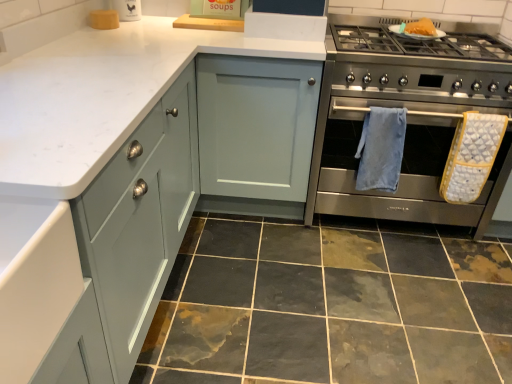
What do you see at coordinates (381, 149) in the screenshot?
I see `blue soft towel at center right, the 2th bath towel positioned from the right` at bounding box center [381, 149].

The height and width of the screenshot is (384, 512). What do you see at coordinates (471, 156) in the screenshot? I see `yellow textured oven mitt at right, positioned as the first bath towel in right-to-left order` at bounding box center [471, 156].

Identify the location of stainless steel oven at right. This screenshot has height=384, width=512. (402, 168).

Between marble tile at lower center and white marble countertop at upper left, which one has less height?

Standing shorter between the two is marble tile at lower center.

Based on their positions, is marble tile at lower center located to the left or right of white marble countertop at upper left?

Based on their positions, marble tile at lower center is located to the right of white marble countertop at upper left.

Is marble tile at lower center oriented towards white marble countertop at upper left?

No, marble tile at lower center does not turn towards white marble countertop at upper left.

From a real-world perspective, is marble tile at lower center under white marble countertop at upper left?

Correct, in the physical world, marble tile at lower center is lower than white marble countertop at upper left.

In the image, is white marble countertop at upper left positioned in front of or behind yellow textured oven mitt at right, positioned as the first bath towel in right-to-left order?

white marble countertop at upper left is positioned closer to the viewer than yellow textured oven mitt at right, positioned as the first bath towel in right-to-left order.

Does white marble countertop at upper left appear on the right side of yellow textured oven mitt at right, placed as the 2th bath towel when sorted from left to right?

No, white marble countertop at upper left is not to the right of yellow textured oven mitt at right, placed as the 2th bath towel when sorted from left to right.

Are white marble countertop at upper left and yellow textured oven mitt at right, placed as the 2th bath towel when sorted from left to right, far apart?

Yes, white marble countertop at upper left and yellow textured oven mitt at right, placed as the 2th bath towel when sorted from left to right, are located far from each other.

From a real-world perspective, which is physically below, white marble countertop at upper left or yellow textured oven mitt at right, placed as the 2th bath towel when sorted from left to right?

In real-world perspective, white marble countertop at upper left is lower.

Would you say blue soft towel at center right, the 2th bath towel positioned from the right, contains stainless steel oven at right?

No, stainless steel oven at right is not a part of blue soft towel at center right, the 2th bath towel positioned from the right.

Are blue soft towel at center right, the 2th bath towel positioned from the right, and stainless steel oven at right located far from each other?

No, blue soft towel at center right, the 2th bath towel positioned from the right, is not far from stainless steel oven at right.

Measure the distance between blue soft towel at center right, the 2th bath towel positioned from the right, and stainless steel oven at right.

A distance of 5.38 inches exists between blue soft towel at center right, the 2th bath towel positioned from the right, and stainless steel oven at right.

In the image, is blue soft towel at center right, arranged as the 1th bath towel when viewed from the left, positioned in front of or behind stainless steel oven at right?

blue soft towel at center right, arranged as the 1th bath towel when viewed from the left, is behind stainless steel oven at right.

From the image's perspective, does stainless steel oven at right appear higher than white marble countertop at upper left?

No.

Is white marble countertop at upper left at the back of stainless steel oven at right?

That's not correct — stainless steel oven at right is not looking away from white marble countertop at upper left.

Are stainless steel oven at right and white marble countertop at upper left beside each other?

No, stainless steel oven at right is not touching white marble countertop at upper left.

Considering the relative positions of stainless steel oven at right and white marble countertop at upper left in the image provided, is stainless steel oven at right in front of white marble countertop at upper left?

Yes, stainless steel oven at right is in front of white marble countertop at upper left.

Considering the relative sizes of stainless steel oven at right and yellow textured oven mitt at right, placed as the 2th bath towel when sorted from left to right, in the image provided, is stainless steel oven at right wider than yellow textured oven mitt at right, placed as the 2th bath towel when sorted from left to right,?

Yes.

Between stainless steel oven at right and yellow textured oven mitt at right, placed as the 2th bath towel when sorted from left to right, which one appears on the left side from the viewer's perspective?

stainless steel oven at right is more to the left.

From a real-world perspective, is stainless steel oven at right beneath yellow textured oven mitt at right, positioned as the first bath towel in right-to-left order?

No, from a real-world perspective, stainless steel oven at right is not beneath yellow textured oven mitt at right, positioned as the first bath towel in right-to-left order.

Looking at this image, is the surface of stainless steel oven at right in direct contact with yellow textured oven mitt at right, placed as the 2th bath towel when sorted from left to right?

There is a gap between stainless steel oven at right and yellow textured oven mitt at right, placed as the 2th bath towel when sorted from left to right.

In the scene shown: Considering the sizes of objects yellow textured oven mitt at right, positioned as the first bath towel in right-to-left order, and marble tile at lower center in the image provided, who is smaller, yellow textured oven mitt at right, positioned as the first bath towel in right-to-left order, or marble tile at lower center?

yellow textured oven mitt at right, positioned as the first bath towel in right-to-left order.

Looking at this image, which object is more forward, yellow textured oven mitt at right, placed as the 2th bath towel when sorted from left to right, or marble tile at lower center?

marble tile at lower center is more forward.

Based on the photo, which object is wider, yellow textured oven mitt at right, positioned as the first bath towel in right-to-left order, or marble tile at lower center?

With larger width is marble tile at lower center.

Who is shorter, yellow textured oven mitt at right, placed as the 2th bath towel when sorted from left to right, or marble tile at lower center?

marble tile at lower center.

Is yellow textured oven mitt at right, positioned as the first bath towel in right-to-left order, taller than stainless steel oven at right?

Incorrect, the height of yellow textured oven mitt at right, positioned as the first bath towel in right-to-left order, is not larger of that of stainless steel oven at right.

Considering the positions of objects yellow textured oven mitt at right, placed as the 2th bath towel when sorted from left to right, and stainless steel oven at right in the image provided, who is in front, yellow textured oven mitt at right, placed as the 2th bath towel when sorted from left to right, or stainless steel oven at right?

stainless steel oven at right is more forward.

Is yellow textured oven mitt at right, placed as the 2th bath towel when sorted from left to right, not within stainless steel oven at right?

That's incorrect, yellow textured oven mitt at right, placed as the 2th bath towel when sorted from left to right, is not completely outside stainless steel oven at right.

At what (x,y) coordinates should I click in order to perform the action: click on ceramic tile in front of the white marble countertop at upper left. Please return your answer as a coordinate pair (x, y). Image resolution: width=512 pixels, height=384 pixels. Looking at the image, I should click on (331, 306).

Starting from the white marble countertop at upper left, which bath towel is the 2nd one to the right? Please provide its 2D coordinates.

[(471, 156)]

Based on their spatial positions, is white marble countertop at upper left or blue soft towel at center right, arranged as the 1th bath towel when viewed from the left, further from stainless steel oven at right?

white marble countertop at upper left lies further to stainless steel oven at right than the other object.

Looking at the image, which one is located further to white marble countertop at upper left, stainless steel oven at right or blue soft towel at center right, the 2th bath towel positioned from the right?

Based on the image, stainless steel oven at right appears to be further to white marble countertop at upper left.

From the image, which object appears to be farther from blue soft towel at center right, the 2th bath towel positioned from the right, yellow textured oven mitt at right, positioned as the first bath towel in right-to-left order, or marble tile at lower center?

The object further to blue soft towel at center right, the 2th bath towel positioned from the right, is marble tile at lower center.

Looking at the image, which one is located closer to white marble countertop at upper left, yellow textured oven mitt at right, placed as the 2th bath towel when sorted from left to right, or marble tile at lower center?

The object closer to white marble countertop at upper left is marble tile at lower center.

Estimate the real-world distances between objects in this image. Which object is closer to marble tile at lower center, blue soft towel at center right, arranged as the 1th bath towel when viewed from the left, or white marble countertop at upper left?

blue soft towel at center right, arranged as the 1th bath towel when viewed from the left, is closer to marble tile at lower center.

Which object lies further to the anchor point yellow textured oven mitt at right, positioned as the first bath towel in right-to-left order, white marble countertop at upper left or blue soft towel at center right, arranged as the 1th bath towel when viewed from the left?

white marble countertop at upper left.

Estimate the real-world distances between objects in this image. Which object is further from white marble countertop at upper left, yellow textured oven mitt at right, placed as the 2th bath towel when sorted from left to right, or stainless steel oven at right?

yellow textured oven mitt at right, placed as the 2th bath towel when sorted from left to right.

Considering their positions, is white marble countertop at upper left positioned further to blue soft towel at center right, the 2th bath towel positioned from the right, than marble tile at lower center?

Among the two, white marble countertop at upper left is located further to blue soft towel at center right, the 2th bath towel positioned from the right.

This screenshot has width=512, height=384. In order to click on oven situated between blue soft towel at center right, the 2th bath towel positioned from the right, and yellow textured oven mitt at right, positioned as the first bath towel in right-to-left order, from left to right in this screenshot , I will do `click(402, 168)`.

Where is `bath towel between white marble countertop at upper left and yellow textured oven mitt at right, positioned as the first bath towel in right-to-left order, from left to right`? The image size is (512, 384). bath towel between white marble countertop at upper left and yellow textured oven mitt at right, positioned as the first bath towel in right-to-left order, from left to right is located at coordinates (381, 149).

Image resolution: width=512 pixels, height=384 pixels. I want to click on bath towel situated between white marble countertop at upper left and stainless steel oven at right from left to right, so click(x=381, y=149).

The height and width of the screenshot is (384, 512). I want to click on oven between white marble countertop at upper left and yellow textured oven mitt at right, placed as the 2th bath towel when sorted from left to right, from left to right, so click(402, 168).